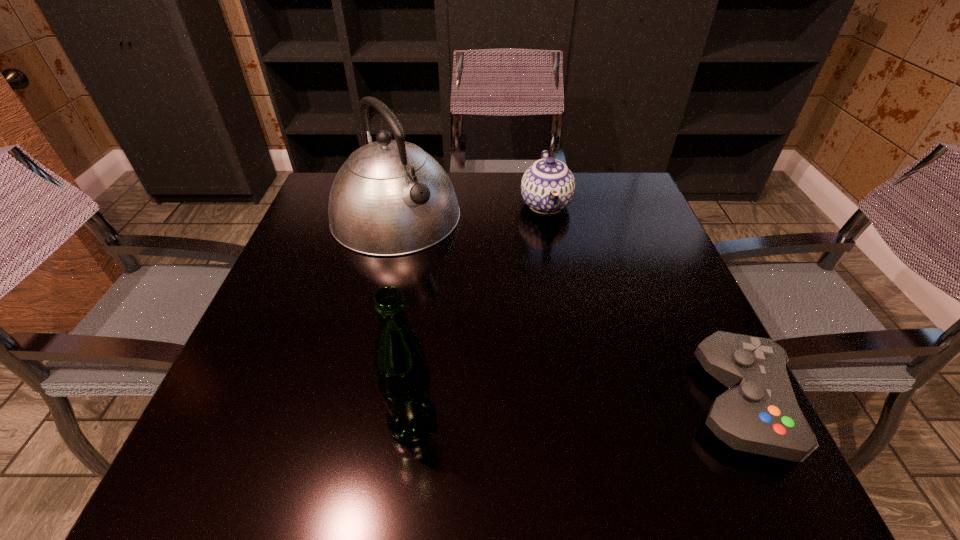
This screenshot has height=540, width=960. I want to click on vacant space that satisfies the following two spatial constraints: 1. on the back side of the kettle; 2. on the right side of the second object from right to left, so click(398, 205).